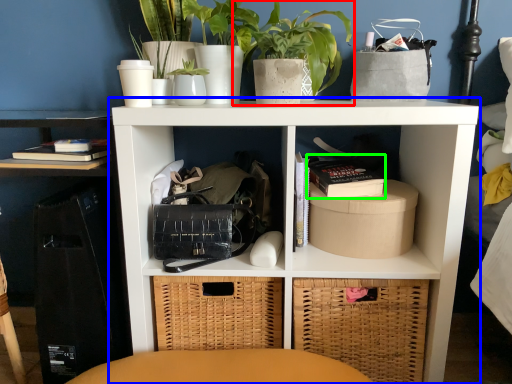
Question: Which object is the closest to the houseplant (highlighted by a red box)? Choose among these: shelf (highlighted by a blue box) or book (highlighted by a green box).

Choices:
 (A) shelf
 (B) book

Answer: (A)